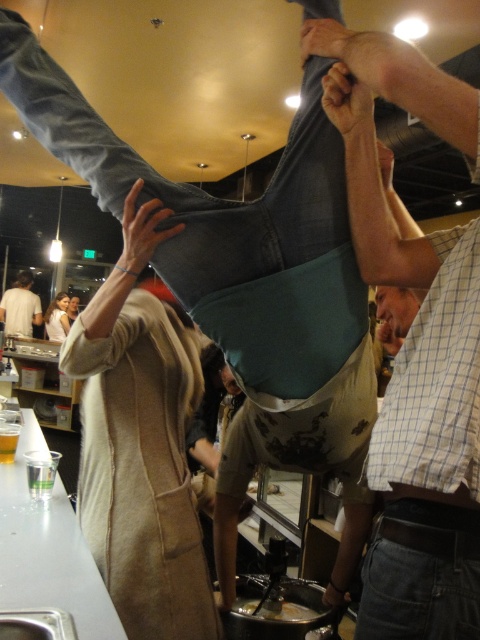
Question: Among these points, which one is farthest from the camera?

Choices:
 (A) pyautogui.click(x=21, y=321)
 (B) pyautogui.click(x=405, y=285)

Answer: (A)

Question: Which of the following is the closest to the observer?

Choices:
 (A) (3, 292)
 (B) (430, 332)
 (C) (292, 605)

Answer: (B)

Question: Does light beige fabric coat at center have a lesser width compared to white cotton shirt at upper left?

Choices:
 (A) yes
 (B) no

Answer: (A)

Question: Which of the following is the farthest from the observer?

Choices:
 (A) (113, 301)
 (B) (367, 465)
 (C) (253, 602)

Answer: (C)

Question: Does denim jeans at center have a smaller size compared to light beige fabric coat at center?

Choices:
 (A) no
 (B) yes

Answer: (B)

Question: Is light beige fabric coat at center wider than shiny silver spoon at lower center?

Choices:
 (A) yes
 (B) no

Answer: (A)